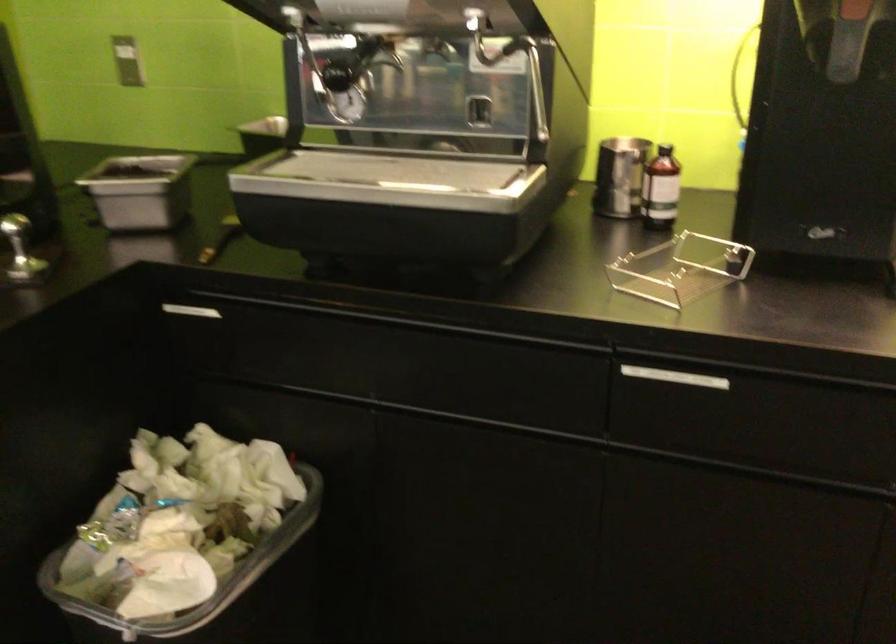
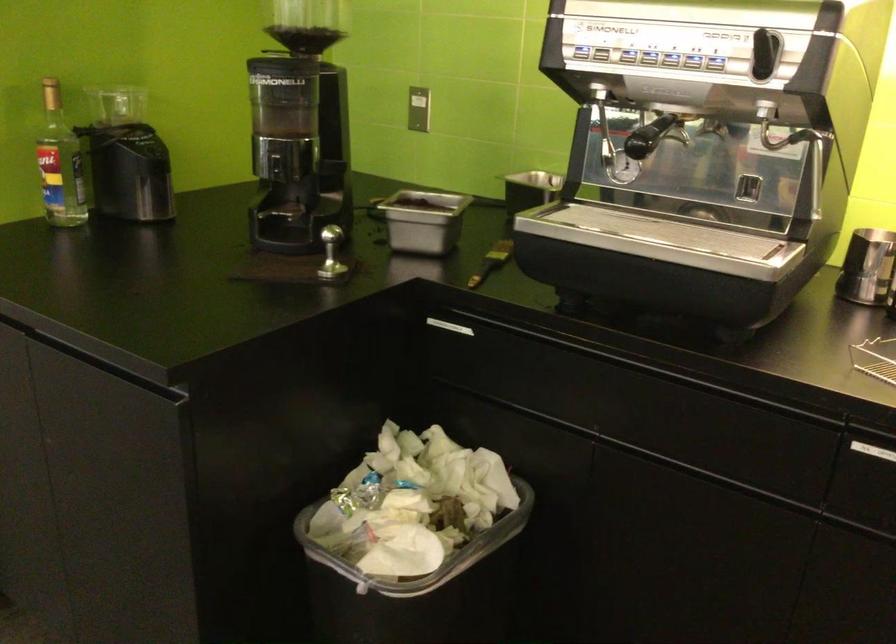
Question: The images are taken continuously from a first-person perspective. In which direction is your viewpoint rotating?

Choices:
 (A) Left
 (B) Right
 (C) Up
 (D) Down

Answer: (A)